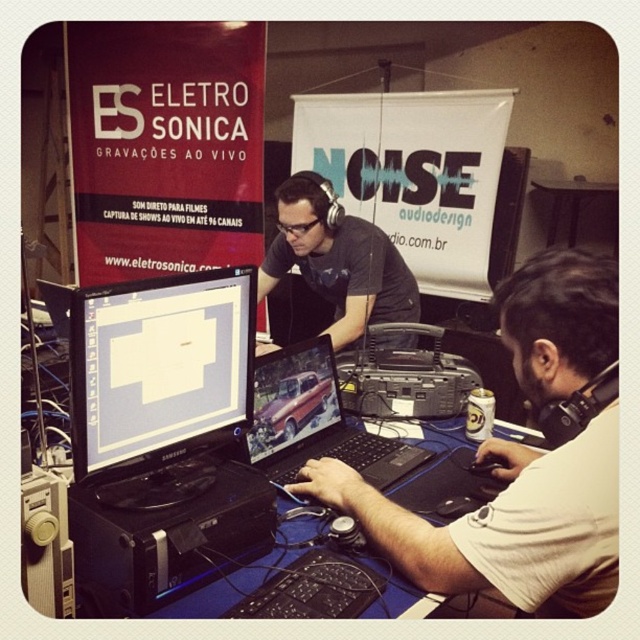
Is white matte shirt at lower right below matte black monitor at center?

Yes, white matte shirt at lower right is below matte black monitor at center.

The width and height of the screenshot is (640, 640). What do you see at coordinates (504, 524) in the screenshot?
I see `white matte shirt at lower right` at bounding box center [504, 524].

You are a GUI agent. You are given a task and a screenshot of the screen. Output one action in this format:
    pyautogui.click(x=<x>, y=<y>)
    Task: Click on the white matte shirt at lower right
    This screenshot has width=640, height=640.
    Given the screenshot: What is the action you would take?
    pyautogui.click(x=504, y=524)

Identify the location of white matte shirt at lower right. The image size is (640, 640). [504, 524].

What do you see at coordinates (504, 524) in the screenshot? I see `white matte shirt at lower right` at bounding box center [504, 524].

Where is `white matte shirt at lower right`? Image resolution: width=640 pixels, height=640 pixels. white matte shirt at lower right is located at coordinates (504, 524).

Can you confirm if black matte headphones at center is smaller than metallic silver laptop at center?

Actually, black matte headphones at center might be larger than metallic silver laptop at center.

Can you confirm if black matte headphones at center is positioned to the right of metallic silver laptop at center?

Yes, black matte headphones at center is to the right of metallic silver laptop at center.

Image resolution: width=640 pixels, height=640 pixels. What are the coordinates of `black matte headphones at center` in the screenshot? It's located at (337, 259).